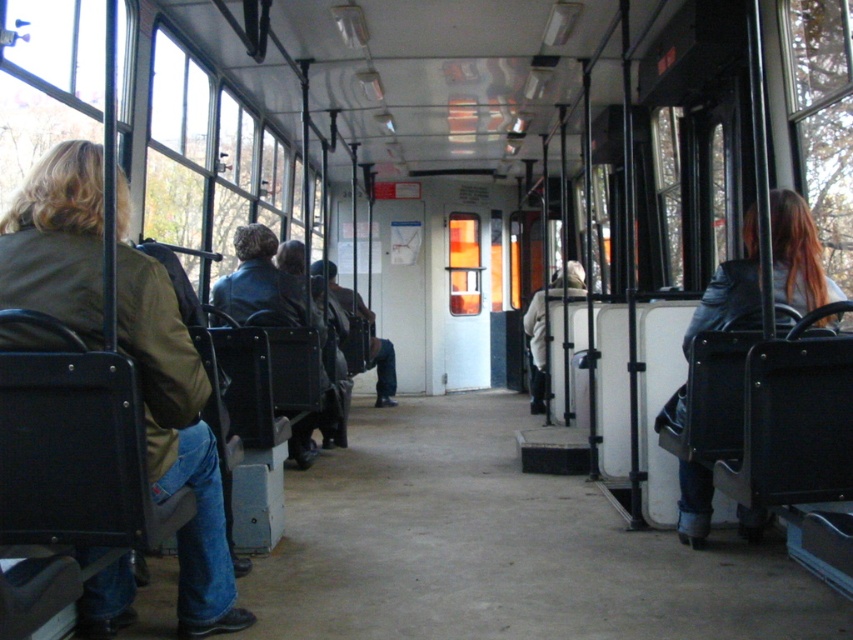
Which is more to the right, leather jacket at right or leather jacket at center?

leather jacket at right

The width and height of the screenshot is (853, 640). I want to click on leather jacket at right, so click(798, 253).

Find the location of a particular element. This screenshot has width=853, height=640. leather jacket at right is located at coordinates (798, 253).

Is leather jacket at right smaller than white fabric coat at center?

Correct, leather jacket at right occupies less space than white fabric coat at center.

Between point (804, 291) and point (550, 289), which one is positioned behind?

The point (550, 289) is behind.

This screenshot has width=853, height=640. In order to click on leather jacket at right in this screenshot , I will do `click(798, 253)`.

Between point (265, 227) and point (582, 275), which one is positioned behind?

Positioned behind is point (582, 275).

Can you confirm if leather jacket at center is positioned below white fabric coat at center?

Incorrect, leather jacket at center is not positioned below white fabric coat at center.

The image size is (853, 640). What are the coordinates of `leather jacket at center` in the screenshot? It's located at (260, 284).